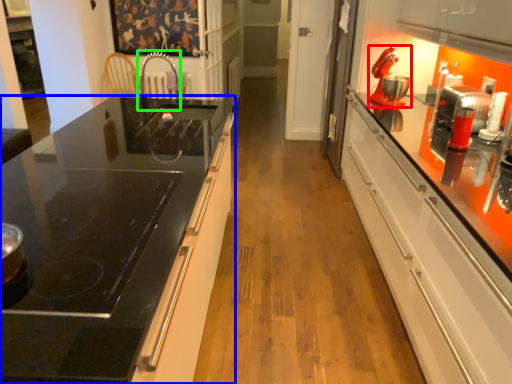
Question: Which is farther away from home appliance (highlighted by a red box)? countertop (highlighted by a blue box) or faucet (highlighted by a green box)?

Choices:
 (A) countertop
 (B) faucet

Answer: (B)